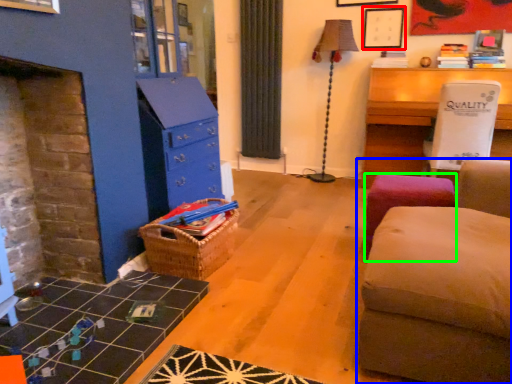
Question: Which is nearer to the picture frame (highlighted by a red box)? studio couch (highlighted by a blue box) or stool (highlighted by a green box).

Choices:
 (A) studio couch
 (B) stool

Answer: (B)